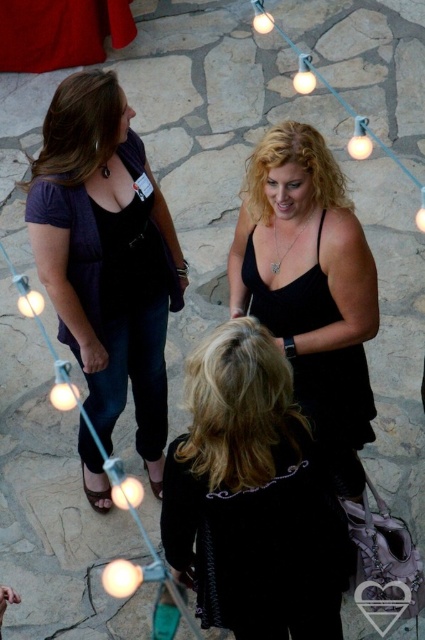
Does point (90, 74) come behind point (322, 285)?

No.

Who is lower down, matte purple blouse at left or black satin dress at center?

matte purple blouse at left is lower down.

The width and height of the screenshot is (425, 640). Describe the element at coordinates (107, 257) in the screenshot. I see `matte purple blouse at left` at that location.

The width and height of the screenshot is (425, 640). I want to click on matte purple blouse at left, so click(107, 257).

Does black velvet jacket at lower center come in front of black satin dress at center?

Yes.

Who is more forward, [231,326] or [340,408]?

Positioned in front is point [231,326].

Who is more distant from viewer, [215,376] or [266,220]?

The point [266,220] is more distant.

You are a GUI agent. You are given a task and a screenshot of the screen. Output one action in this format:
    pyautogui.click(x=<x>, y=<y>)
    Task: Click on the black velvet jacket at lower center
    Image resolution: width=425 pixels, height=640 pixels.
    Given the screenshot: What is the action you would take?
    pyautogui.click(x=252, y=497)

What do you see at coordinates (252, 497) in the screenshot? I see `black velvet jacket at lower center` at bounding box center [252, 497].

Is black velvet jacket at lower center bigger than matte purple blouse at left?

No, black velvet jacket at lower center is not bigger than matte purple blouse at left.

Who is more distant from viewer, (166, 465) or (68, 83)?

Positioned behind is point (68, 83).

Where is `black velvet jacket at lower center`? This screenshot has width=425, height=640. black velvet jacket at lower center is located at coordinates (252, 497).